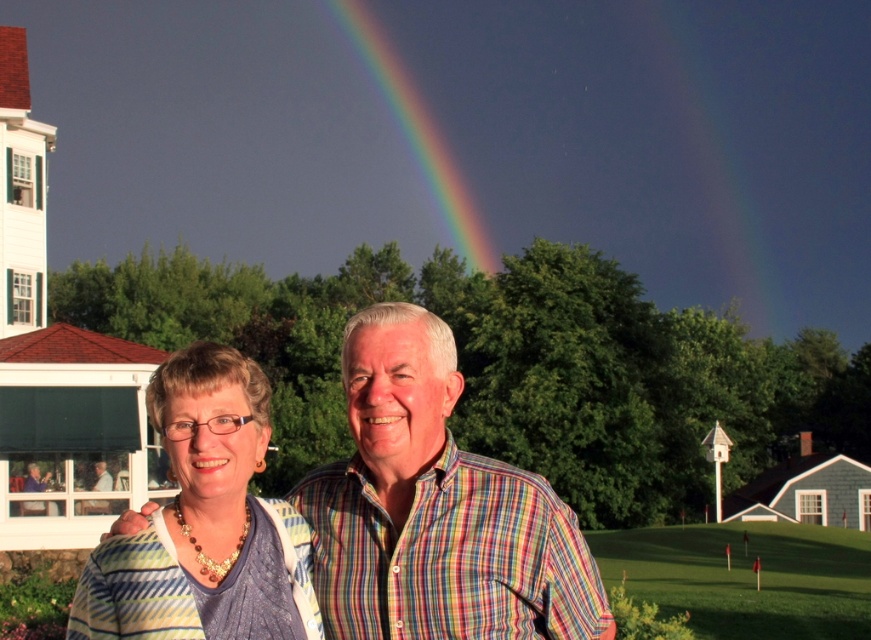
You are a photographer trying to capture a wide shot of the striped fabric shirt at center and the green grass at lower right. Since the shirt is narrower than the grass, will you need to adjust your camera angle to ensure both fit in the frame?

The striped fabric shirt at center is narrower than the green grass at lower right, so adjusting the camera angle might be necessary to ensure both fit in the frame, especially if the grass occupies more horizontal space.

You are standing in the scene and want to walk from the matte black shirt at center to the green grass at lower right. Which direction should you move?

You should move to the right because the green grass at lower right is located to the right of the matte black shirt at center.